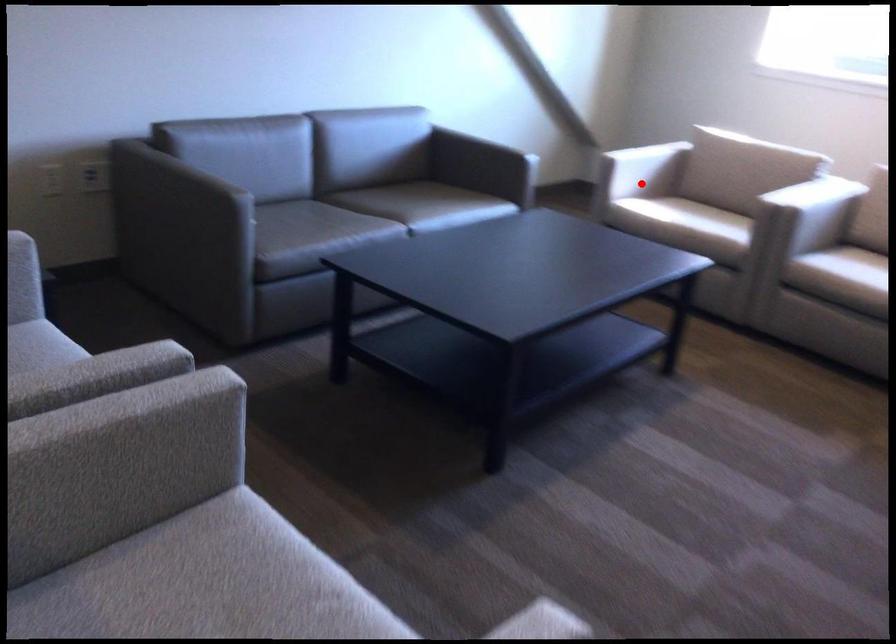
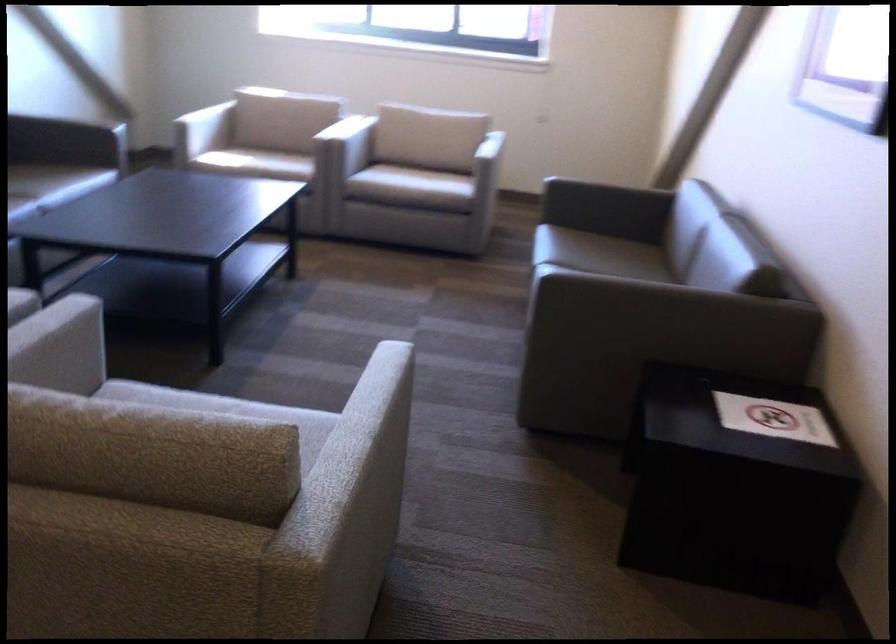
Question: I am providing you with two images of the same scene from different viewpoints. Given a red point in image1, look at the same physical point in image2. Is it:

Choices:
 (A) Closer to the viewpoint
 (B) Farther from the viewpoint

Answer: (B)